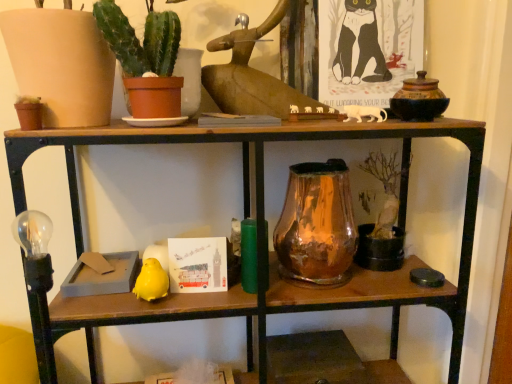
Question: Do you think yellow matte bird at lower left is within amber glass vase at center, or outside of it?

Choices:
 (A) outside
 (B) inside

Answer: (A)

Question: Considering the positions of yellow matte bird at lower left and amber glass vase at center in the image, is yellow matte bird at lower left wider or thinner than amber glass vase at center?

Choices:
 (A) thin
 (B) wide

Answer: (A)

Question: Considering the real-world distances, which object is farthest from the green matte cactus at upper left?

Choices:
 (A) yellow matte bird at lower left
 (B) amber glass vase at center

Answer: (A)

Question: Based on their relative distances, which object is farther from the amber glass vase at center?

Choices:
 (A) green matte cactus at upper left
 (B) yellow matte bird at lower left

Answer: (A)